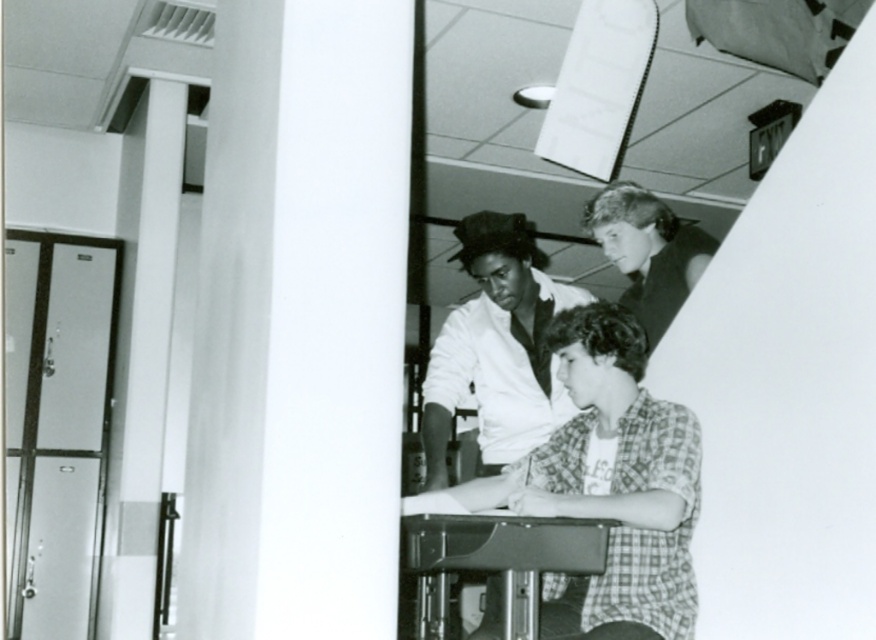
You are a photographer who just took a black and white photo of a scene with a metallic gray table at center and a person with smooth light brown hair at upper right. You want to ensure that the composition highlights the table and the person equally. Based on their positions, which object should you adjust to be more centered in the frame?

The metallic gray table at center is positioned on the left side of smooth light brown hair at upper right, so to balance the composition, you should adjust the smooth light brown hair at upper right to be more centered in the frame.

You are a photographer standing behind the metallic gray table at center and the smooth light brown hair at upper right. You want to take a picture that includes both subjects without moving either. Is the distance between them sufficient to fit both in a standard camera frame that has a maximum width of 1.5 meters?

The metallic gray table at center and smooth light brown hair at upper right are 1.21 meters apart, which is less than the camera frame width of 1.5 meters. Therefore, both subjects can fit within the frame without moving.

You are a photographer trying to capture a closeup of the smooth white shirt at center and the smooth light brown hair at upper right. Which object should you zoom in on first to ensure both are in frame?

You should zoom in on the smooth white shirt at center first because it is wider than the smooth light brown hair at upper right, ensuring it fits within the frame before adjusting for the narrower object.